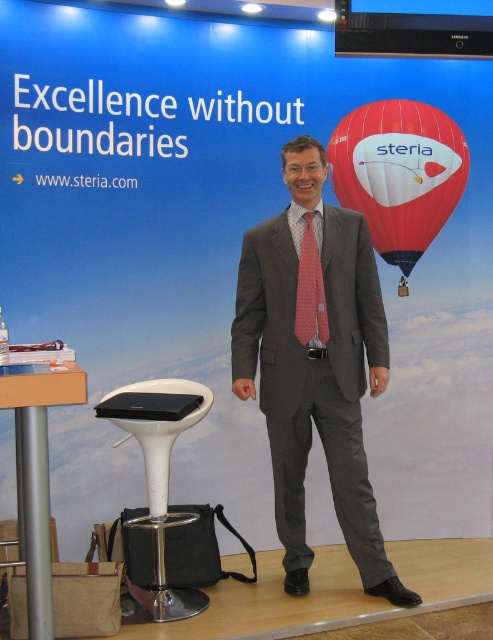
Question: Can you confirm if gray suit at center is positioned to the left of white plastic bar stool at lower left?

Choices:
 (A) no
 (B) yes

Answer: (A)

Question: Which point appears closest to the camera in this image?

Choices:
 (A) (293, 516)
 (B) (371, 152)
 (C) (296, 301)
 (D) (167, 468)

Answer: (D)

Question: Which object is closer to the camera taking this photo?

Choices:
 (A) red glossy hot air balloon at upper right
 (B) white plastic bar stool at lower left
 (C) pink dotted tie at center

Answer: (B)

Question: Is red glossy hot air balloon at upper right further to the viewer compared to white plastic bar stool at lower left?

Choices:
 (A) no
 (B) yes

Answer: (B)

Question: Where is red glossy hot air balloon at upper right located in relation to white plastic bar stool at lower left in the image?

Choices:
 (A) left
 (B) right

Answer: (B)

Question: Which of the following is the farthest from the observer?

Choices:
 (A) gray suit at center
 (B) white plastic bar stool at lower left
 (C) red glossy hot air balloon at upper right

Answer: (C)